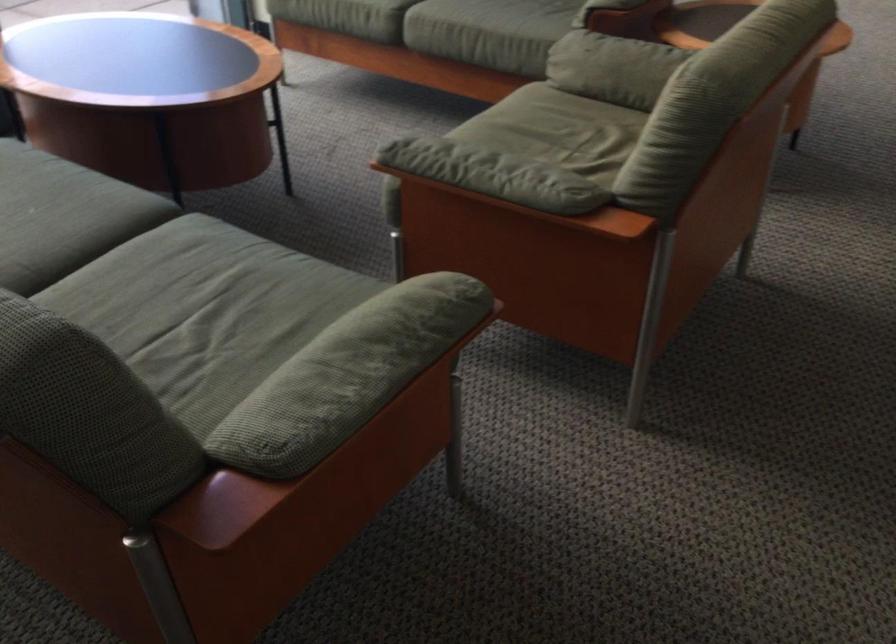
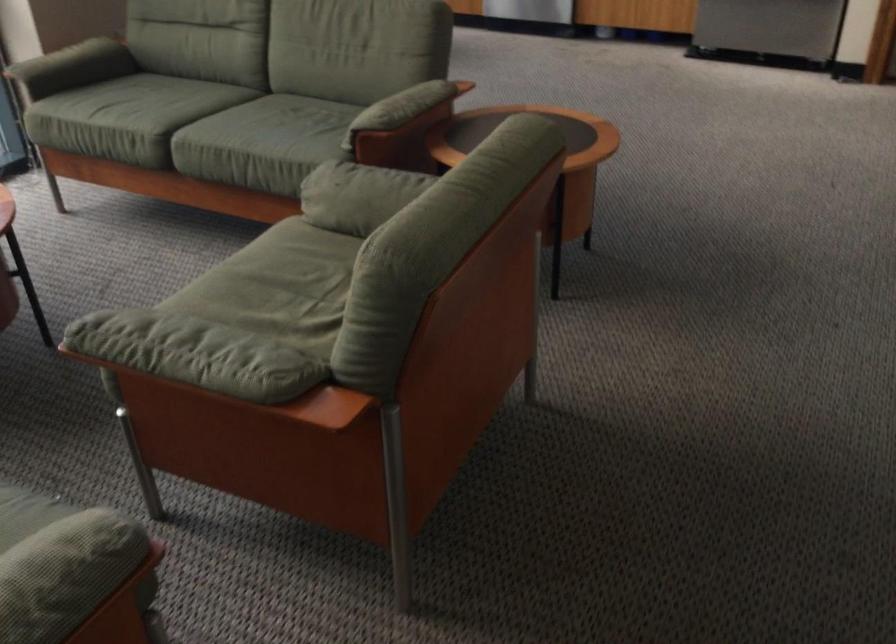
Question: The images are taken continuously from a first-person perspective. In which direction is your viewpoint rotating?

Choices:
 (A) Left
 (B) Right
 (C) Up
 (D) Down

Answer: (B)